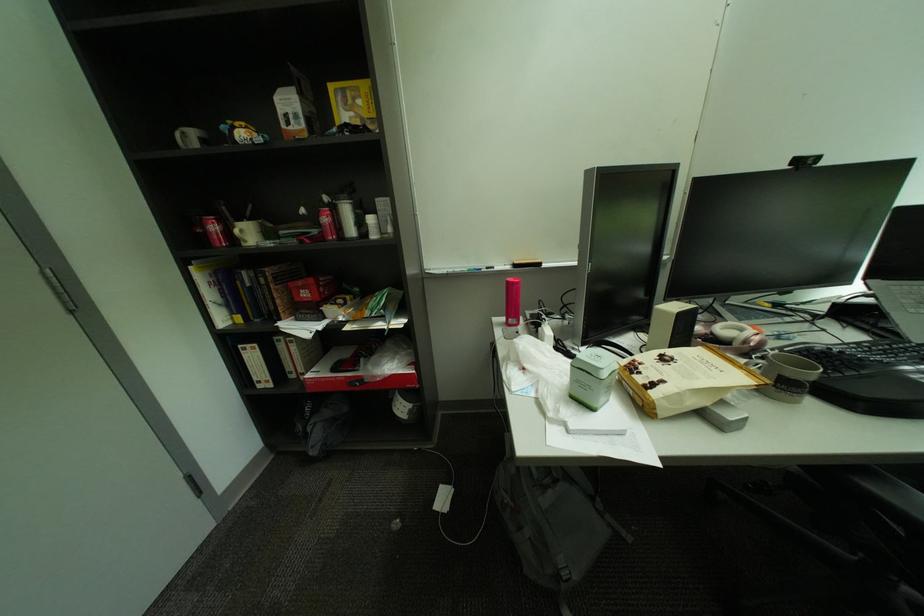
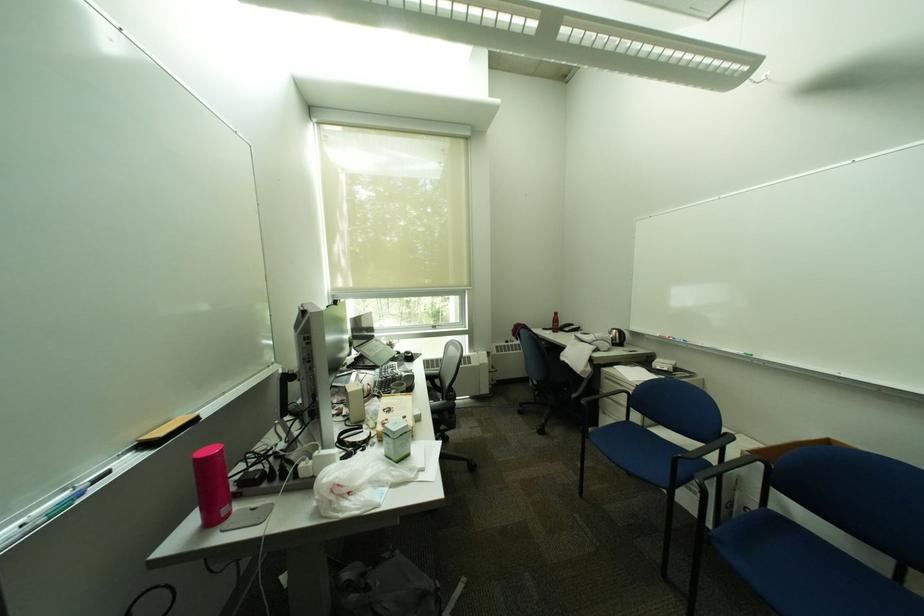
Question: The images are taken continuously from a first-person perspective. In which direction is your viewpoint rotating?

Choices:
 (A) Left
 (B) Right
 (C) Up
 (D) Down

Answer: (B)